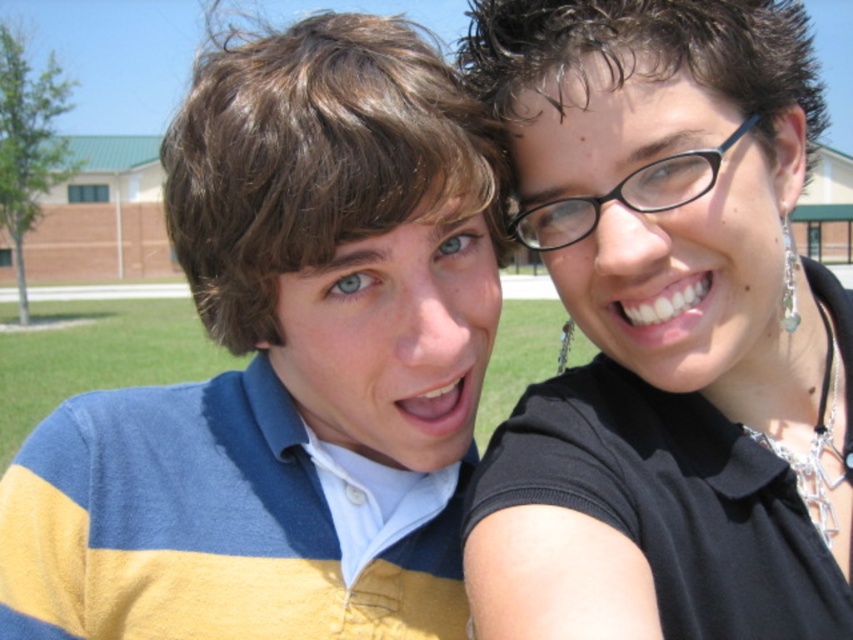
Question: Where is yellow striped sweater at left located in relation to black glossy shirt at upper right in the image?

Choices:
 (A) above
 (B) below

Answer: (B)

Question: Is black glossy shirt at upper right to the left of black plastic glasses at upper right from the viewer's perspective?

Choices:
 (A) yes
 (B) no

Answer: (B)

Question: Which of the following is the closest to the observer?

Choices:
 (A) (334, 243)
 (B) (764, 81)

Answer: (B)

Question: Does yellow striped sweater at left appear on the left side of black glossy shirt at upper right?

Choices:
 (A) yes
 (B) no

Answer: (A)

Question: Which object is farther from the camera taking this photo?

Choices:
 (A) yellow striped sweater at left
 (B) black glossy shirt at upper right
 (C) black plastic glasses at upper right

Answer: (A)

Question: Which point is closer to the camera taking this photo?

Choices:
 (A) (283, 428)
 (B) (820, 492)

Answer: (B)